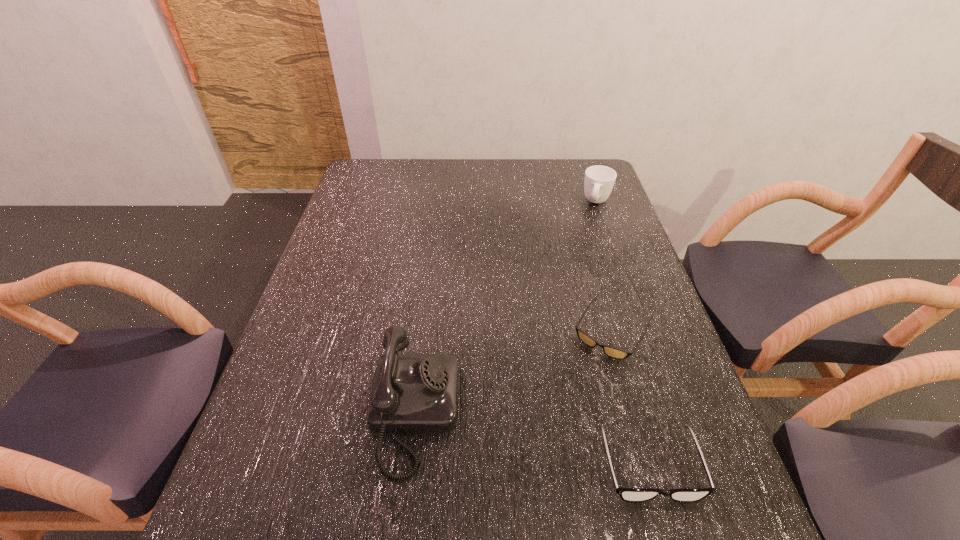
I want to click on object that is at the near right corner, so click(626, 494).

In the image, there is a desktop. At what (x,y) coordinates should I click in order to perform the action: click on free space at the far edge. Please return your answer as a coordinate pair (x, y). The image size is (960, 540). Looking at the image, I should click on tap(433, 160).

I want to click on free space at the near edge, so click(x=540, y=485).

Where is `vacant region at the left edge of the desktop`? This screenshot has width=960, height=540. vacant region at the left edge of the desktop is located at coordinates (314, 356).

This screenshot has height=540, width=960. Find the location of `free space at the right edge of the desktop`. free space at the right edge of the desktop is located at coordinates (628, 402).

Image resolution: width=960 pixels, height=540 pixels. In the image, there is a desktop. What are the coordinates of `vacant space at the far left corner` in the screenshot? It's located at (398, 176).

You are a GUI agent. You are given a task and a screenshot of the screen. Output one action in this format:
    pyautogui.click(x=<x>, y=<y>)
    Task: Click on the free space at the near right corner
    The image size is (960, 540).
    Given the screenshot: What is the action you would take?
    (699, 463)

Locate an element on the screen. free space between the third shortest object and the sunglasses is located at coordinates [x=605, y=266].

Locate an element on the screen. The width and height of the screenshot is (960, 540). unoccupied area between the tallest object and the third tallest object is located at coordinates (532, 439).

This screenshot has width=960, height=540. I want to click on free space between the second tallest object and the shortest object, so click(605, 266).